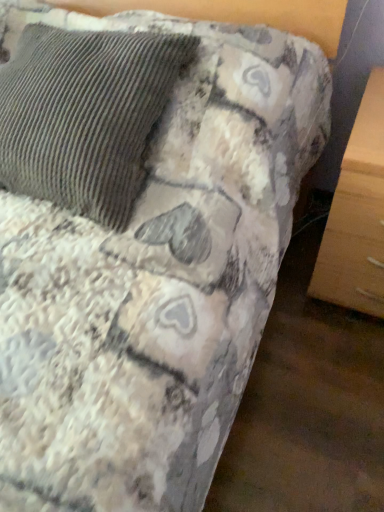
Question: Is textured corduroy pillow at upper left looking in the opposite direction of light wood drawer at lower right?

Choices:
 (A) no
 (B) yes

Answer: (A)

Question: Is textured corduroy pillow at upper left thinner than light wood drawer at lower right?

Choices:
 (A) yes
 (B) no

Answer: (A)

Question: Does textured corduroy pillow at upper left appear on the right side of light wood drawer at lower right?

Choices:
 (A) yes
 (B) no

Answer: (B)

Question: Is textured corduroy pillow at upper left touching light wood drawer at lower right?

Choices:
 (A) yes
 (B) no

Answer: (B)

Question: Is textured corduroy pillow at upper left completely or partially outside of light wood drawer at lower right?

Choices:
 (A) yes
 (B) no

Answer: (A)

Question: Is textured corduroy pillow at upper left positioned far away from light wood drawer at lower right?

Choices:
 (A) no
 (B) yes

Answer: (A)

Question: Is light wood drawer at lower right located outside textured corduroy pillow at upper left?

Choices:
 (A) yes
 (B) no

Answer: (A)

Question: Is light wood drawer at lower right facing towards textured corduroy pillow at upper left?

Choices:
 (A) no
 (B) yes

Answer: (A)

Question: From a real-world perspective, is light wood drawer at lower right positioned over textured corduroy pillow at upper left based on gravity?

Choices:
 (A) yes
 (B) no

Answer: (B)

Question: From a real-world perspective, is light wood drawer at lower right positioned under textured corduroy pillow at upper left based on gravity?

Choices:
 (A) no
 (B) yes

Answer: (B)

Question: Is light wood drawer at lower right positioned before textured corduroy pillow at upper left?

Choices:
 (A) yes
 (B) no

Answer: (B)

Question: From the image's perspective, would you say light wood drawer at lower right is positioned over textured corduroy pillow at upper left?

Choices:
 (A) no
 (B) yes

Answer: (A)

Question: Considering the positions of textured corduroy pillow at upper left and light wood drawer at lower right in the image, is textured corduroy pillow at upper left bigger or smaller than light wood drawer at lower right?

Choices:
 (A) big
 (B) small

Answer: (A)